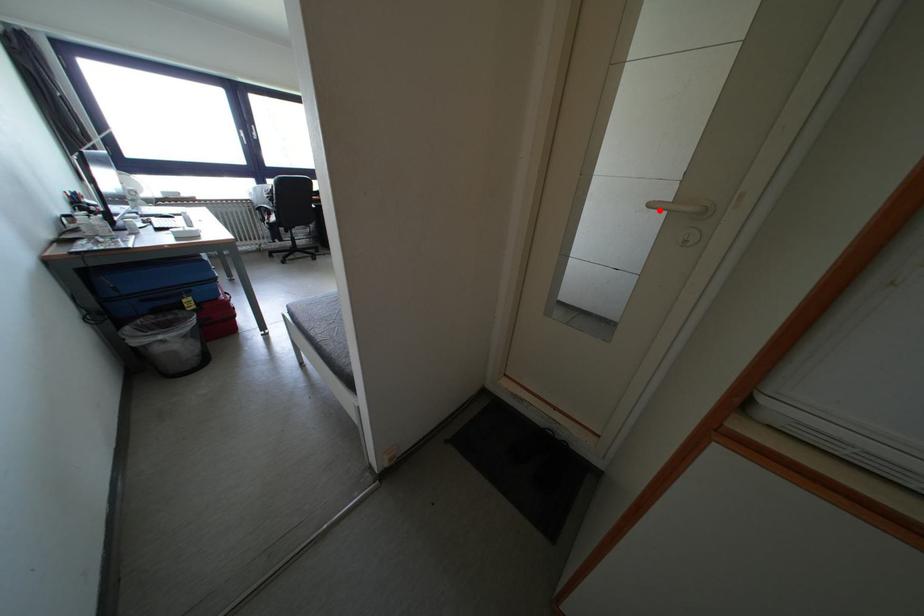
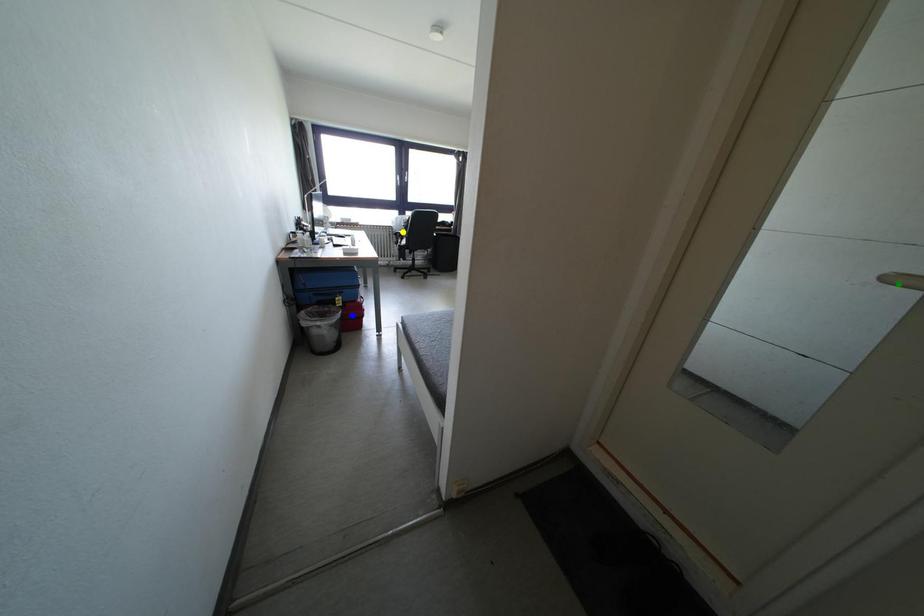
Question: I am providing you with two images of the same scene from different viewpoints. A red point is marked on the first image. You are given multiple points on the second image. Which mark in image 2 goes with the point in image 1?

Choices:
 (A) green point
 (B) blue point
 (C) yellow point

Answer: (A)